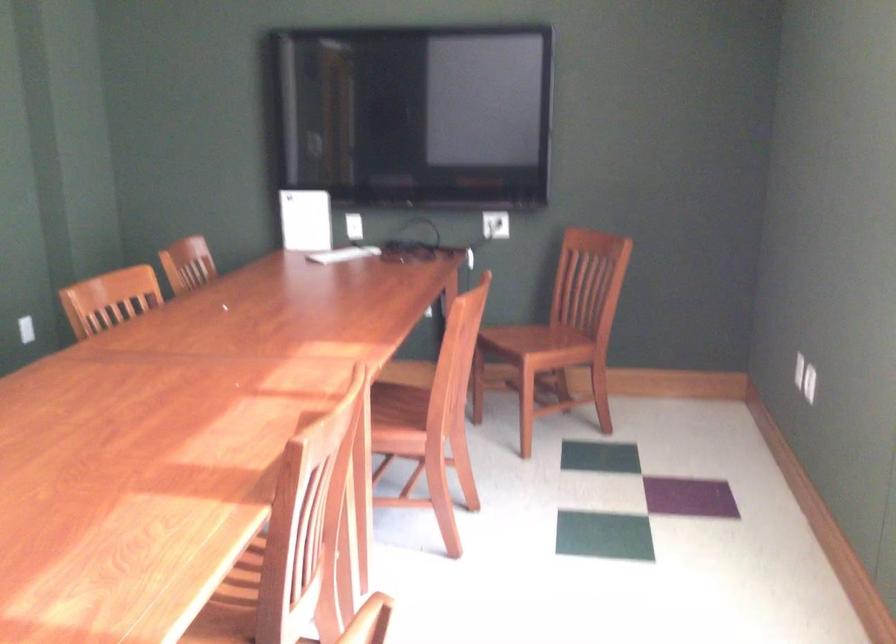
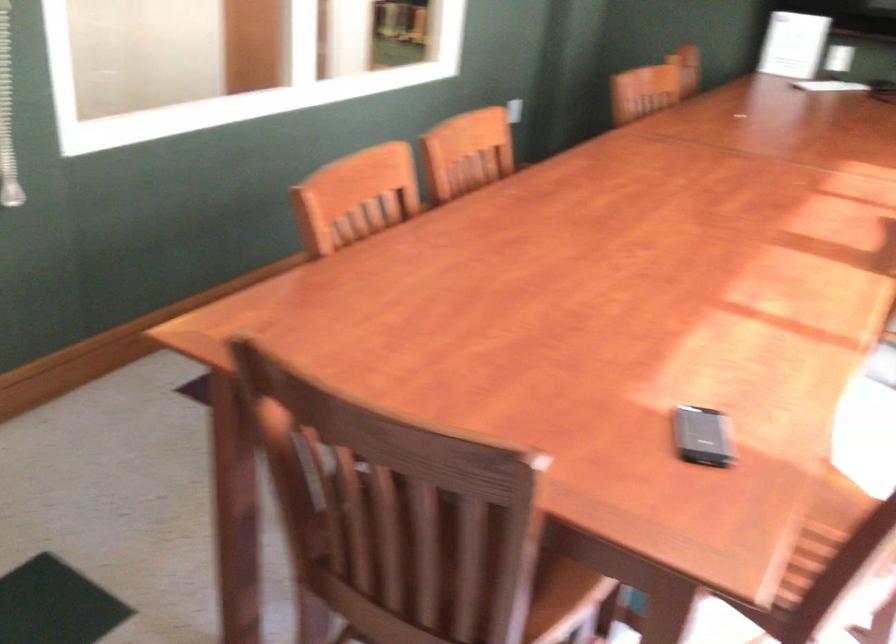
Question: The images are taken continuously from a first-person perspective. In which direction is your viewpoint rotating?

Choices:
 (A) Left
 (B) Right
 (C) Up
 (D) Down

Answer: (A)